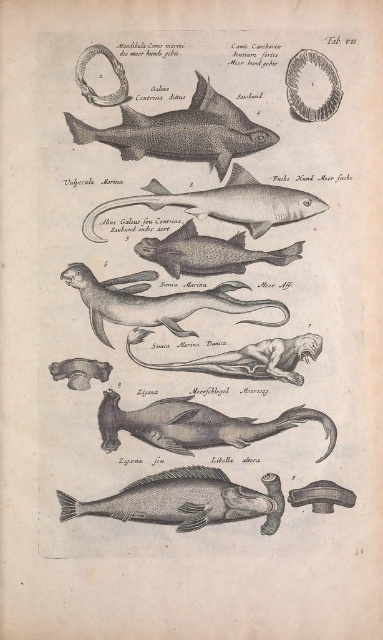
You are examining the illustration labeled Tab. VII from a historical publication. There is a point at coordinates point (206,296). If you are standing 4.73 feet away from this point, can you comfortably read the Latin text accompanying the jawbone illustration without moving closer?

The point at point (206,296) is 4.73 feet away from the viewer. Since the distance matches your current position, you can comfortably read the Latin text accompanying the jawbone illustration without needing to move closer.

You are examining the illustration labeled Tab. VII from a historical publication. You notice two points marked at coordinates point (x=147, y=129) and point (x=268, y=490). Which of these points is positioned closer to your line of sight?

Point (x=147, y=129) is closer to the viewer than point (x=268, y=490).

You are a marine biologist examining the illustrations in this publication. You notice the gray matte shark at upper center and the grayish matte fish at lower center. Which of these two marine creatures is depicted in a larger scale in the illustration?

The gray matte shark at upper center is depicted in a larger scale compared to the grayish matte fish at lower center.